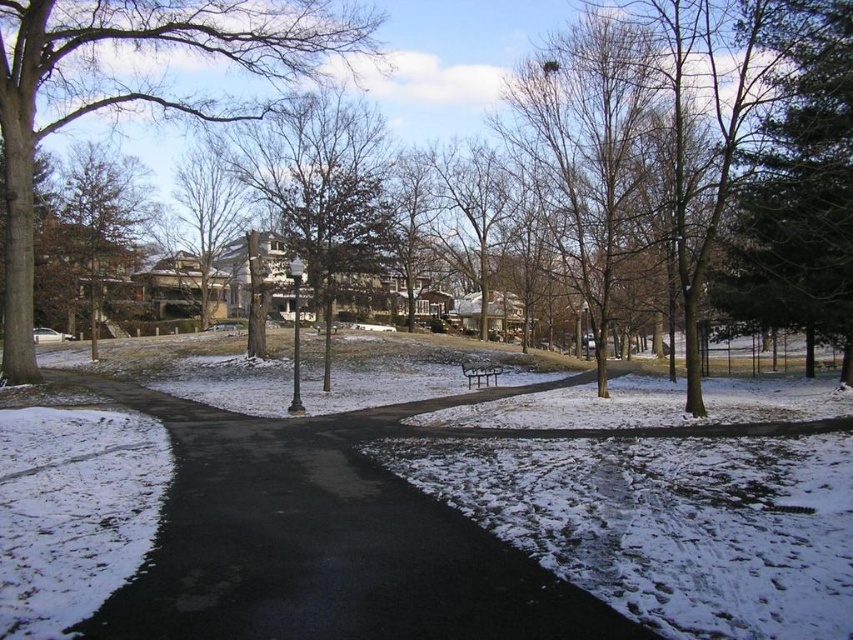
You are a delivery person with a cart that is 1.2 meters wide. You need to navigate through the black asphalt path at center and around the dark green textured evergreen tree at right. Can your cart fit through the path without touching the tree?

The black asphalt path at center is wider than the dark green textured evergreen tree at right, so the cart can fit through the path without touching the tree.